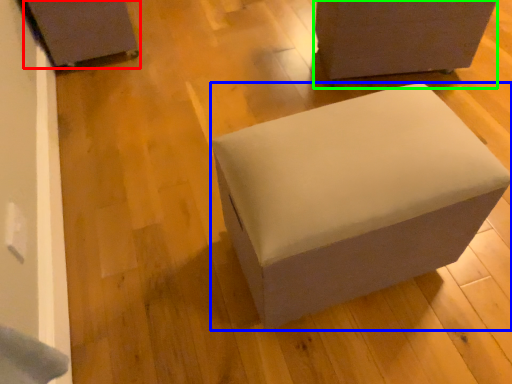
Question: Considering the real-world distances, which object is closest to furniture (highlighted by a red box)? furniture (highlighted by a blue box) or furniture (highlighted by a green box).

Choices:
 (A) furniture
 (B) furniture

Answer: (B)